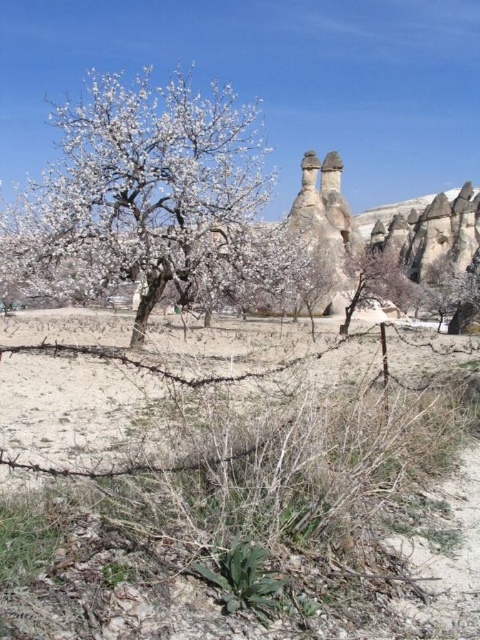
Is white blossoming tree at center to the right of brown sandy dirt field at center from the viewer's perspective?

Incorrect, white blossoming tree at center is not on the right side of brown sandy dirt field at center.

Between white blossoming tree at center and brown sandy dirt field at center, which one has less height?

brown sandy dirt field at center is shorter.

Identify the location of white blossoming tree at center. (151, 198).